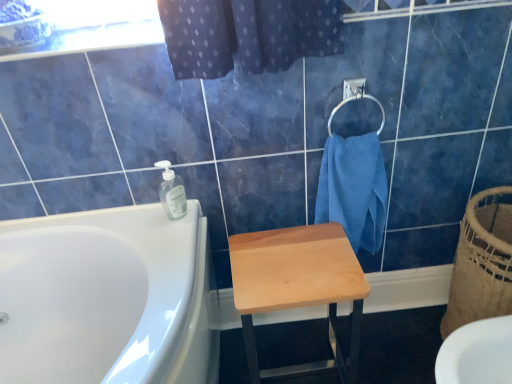
Where is `free space above natural wood stool at center (from a real-world perspective)`? The height and width of the screenshot is (384, 512). free space above natural wood stool at center (from a real-world perspective) is located at coordinates 294,260.